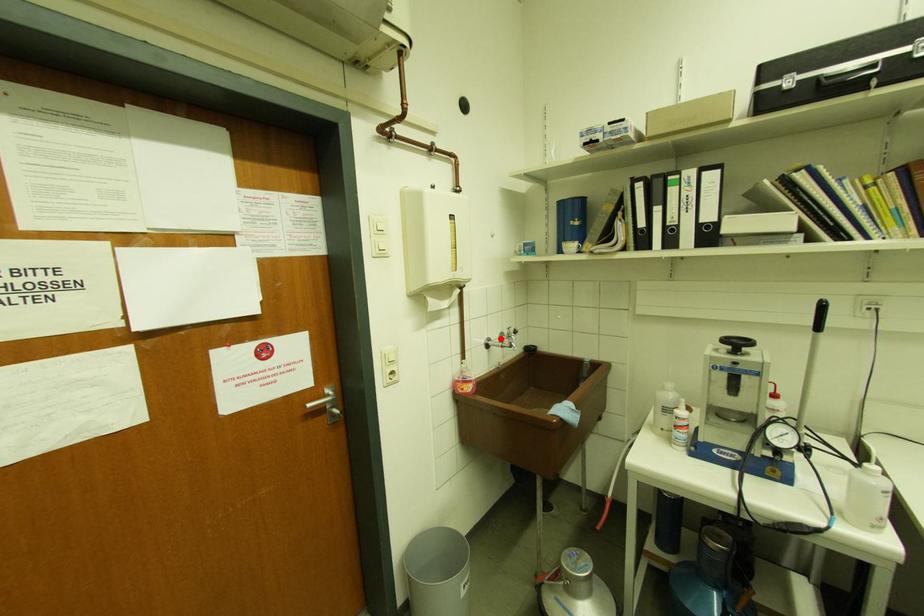
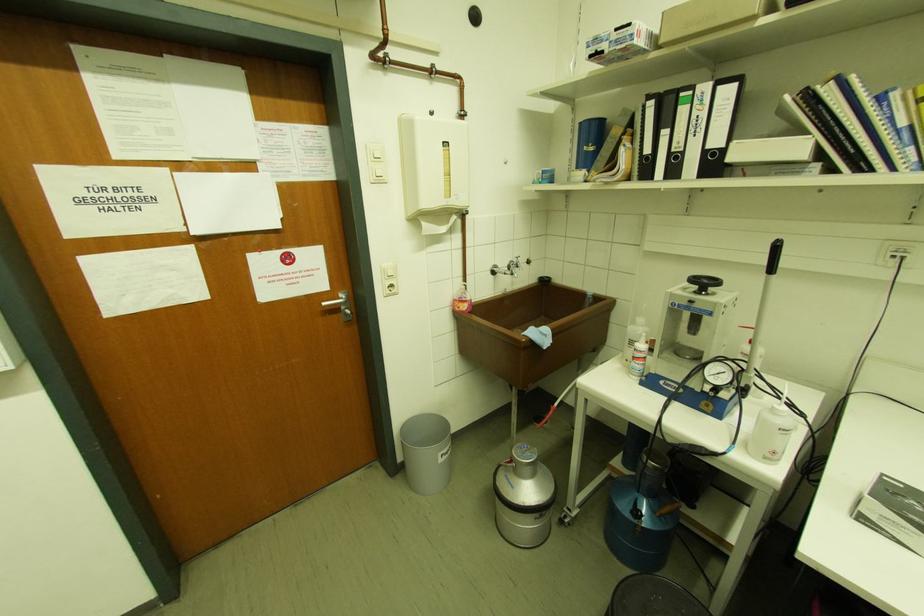
Locate, in the second image, the point that corresponds to the highlighted location in the first image.

(509, 267)